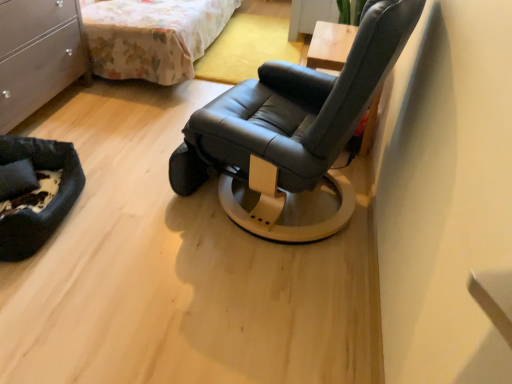
You are a GUI agent. You are given a task and a screenshot of the screen. Output one action in this format:
    pyautogui.click(x=<x>, y=<y>)
    Task: Click on the vacant area in front of black leather chair at center
    This screenshot has width=512, height=384.
    Given the screenshot: What is the action you would take?
    pyautogui.click(x=220, y=304)